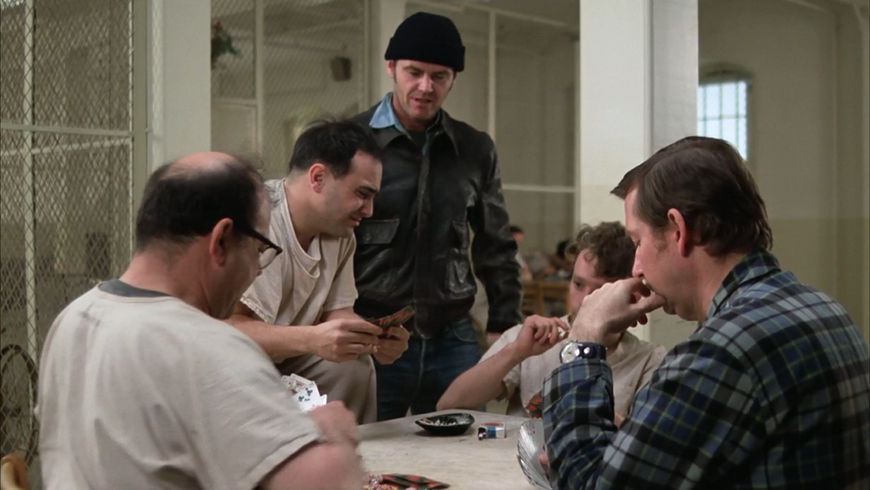
Where is `ash tray`? ash tray is located at coordinates (452, 427).